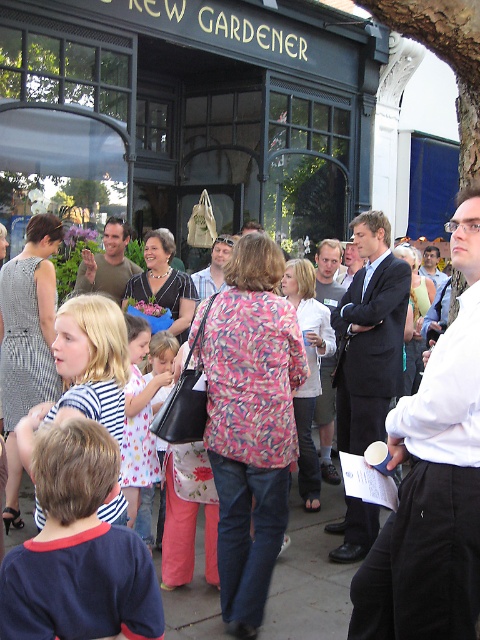
Can you confirm if floral-patterned jacket at center is positioned below white dotted dress at center?

Correct, floral-patterned jacket at center is located below white dotted dress at center.

Does floral-patterned jacket at center appear over white dotted dress at center?

Actually, floral-patterned jacket at center is below white dotted dress at center.

You are a GUI agent. You are given a task and a screenshot of the screen. Output one action in this format:
    pyautogui.click(x=<x>, y=<y>)
    Task: Click on the floral-patterned jacket at center
    This screenshot has height=640, width=480.
    Given the screenshot: What is the action you would take?
    [310, 577]

Where is `floral-patterned jacket at center`? floral-patterned jacket at center is located at coordinates (310, 577).